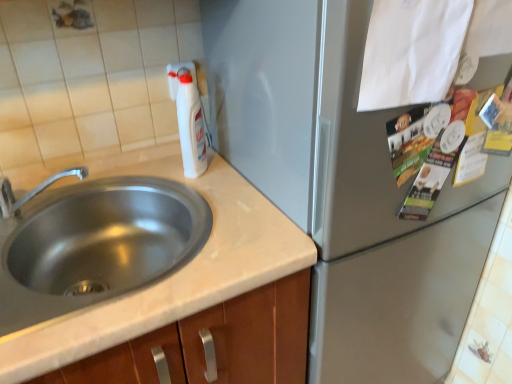
Question: Is stainless steel sink at left not inside brushed metal faucet at left?

Choices:
 (A) yes
 (B) no

Answer: (A)

Question: From a real-world perspective, is stainless steel sink at left on brushed metal faucet at left?

Choices:
 (A) no
 (B) yes

Answer: (A)

Question: Is stainless steel sink at left oriented towards brushed metal faucet at left?

Choices:
 (A) yes
 (B) no

Answer: (B)

Question: From the image's perspective, is stainless steel sink at left beneath brushed metal faucet at left?

Choices:
 (A) no
 (B) yes

Answer: (B)

Question: Does stainless steel sink at left have a greater width compared to brushed metal faucet at left?

Choices:
 (A) yes
 (B) no

Answer: (A)

Question: Would you consider stainless steel sink at left to be distant from brushed metal faucet at left?

Choices:
 (A) yes
 (B) no

Answer: (B)

Question: From a real-world perspective, is stainless steel sink at left physically above white paper at upper right?

Choices:
 (A) yes
 (B) no

Answer: (B)

Question: From the image's perspective, would you say stainless steel sink at left is shown under white paper at upper right?

Choices:
 (A) no
 (B) yes

Answer: (B)

Question: From the image's perspective, is stainless steel sink at left on white paper at upper right?

Choices:
 (A) no
 (B) yes

Answer: (A)

Question: Considering the relative sizes of stainless steel sink at left and white paper at upper right in the image provided, is stainless steel sink at left smaller than white paper at upper right?

Choices:
 (A) yes
 (B) no

Answer: (B)

Question: Is stainless steel sink at left outside white paper at upper right?

Choices:
 (A) yes
 (B) no

Answer: (A)

Question: Is stainless steel sink at left in contact with white paper at upper right?

Choices:
 (A) yes
 (B) no

Answer: (B)

Question: Is white paper at upper right bigger than satin silver refrigerator at center?

Choices:
 (A) no
 (B) yes

Answer: (A)